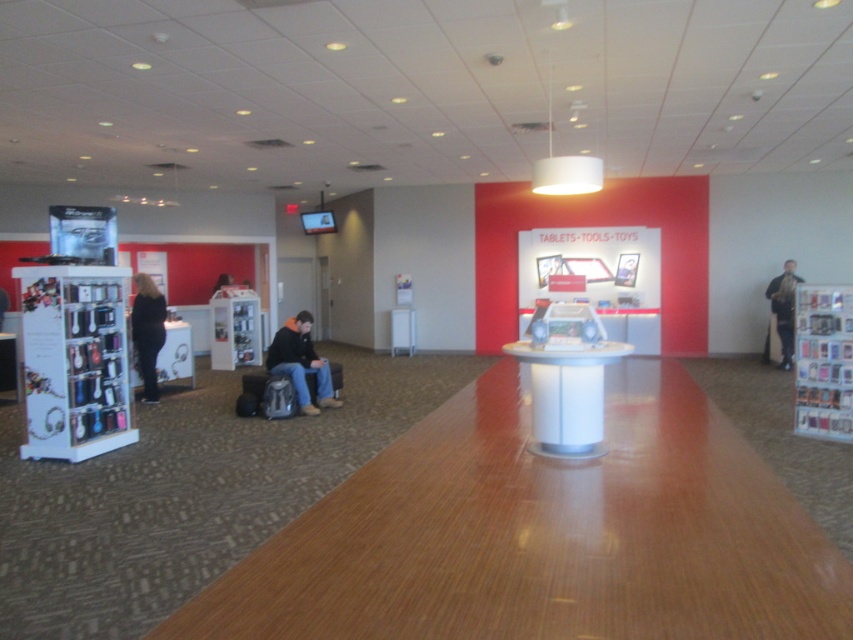
Question: Which point is closer to the camera?

Choices:
 (A) dark blue jeans at center right
 (B) black fabric pants at left

Answer: (B)

Question: Is black fabric pants at left above black leather jacket at upper center?

Choices:
 (A) yes
 (B) no

Answer: (B)

Question: Can you confirm if dark blue jeans at center is wider than black leather jacket at upper center?

Choices:
 (A) no
 (B) yes

Answer: (B)

Question: Is dark blue jeans at center above black fabric pants at left?

Choices:
 (A) yes
 (B) no

Answer: (B)

Question: Which point appears farthest from the camera in this image?

Choices:
 (A) (791, 312)
 (B) (154, 368)

Answer: (A)

Question: Which point is farther to the camera?

Choices:
 (A) dark blue jeans at center right
 (B) black fabric pants at left
 (C) black leather jacket at upper center
 (D) dark blue jeans at center

Answer: (C)